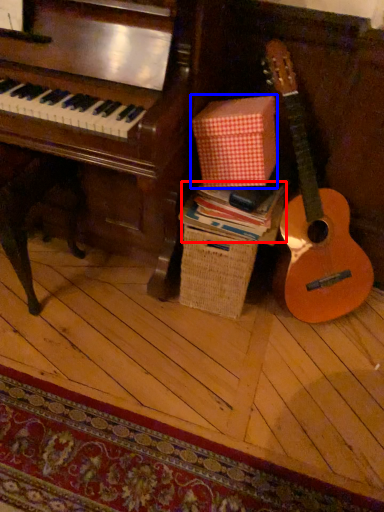
Question: Which point is closer to the camera, book (highlighted by a red box) or cardboard box (highlighted by a blue box)?

Choices:
 (A) book
 (B) cardboard box

Answer: (B)